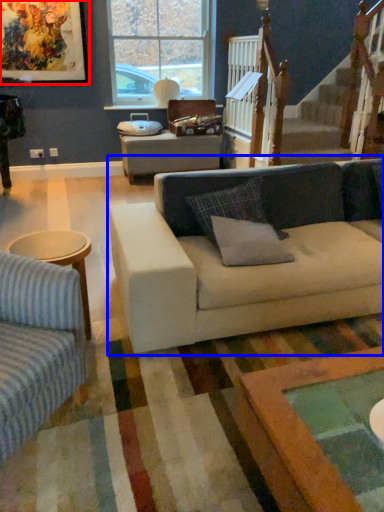
Question: Which point is further to the camera, picture frame (highlighted by a red box) or studio couch (highlighted by a blue box)?

Choices:
 (A) picture frame
 (B) studio couch

Answer: (A)